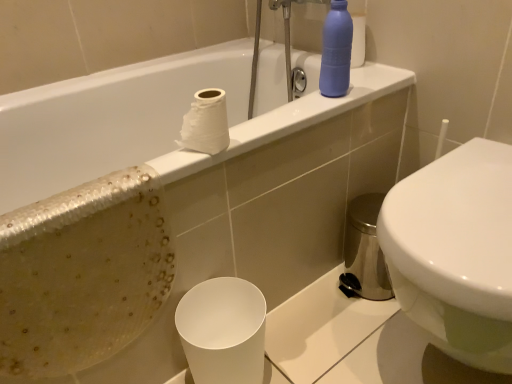
The image size is (512, 384). Identify the location of free location to the right of white matte toilet paper at upper center. (265, 130).